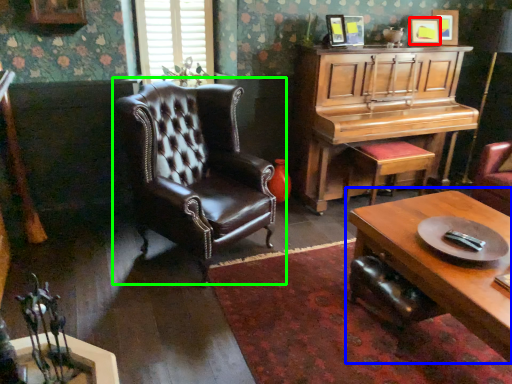
Question: Based on their relative distances, which object is nearer to picture frame (highlighted by a red box)? Choose from coffee table (highlighted by a blue box) and chair (highlighted by a green box).

Choices:
 (A) coffee table
 (B) chair

Answer: (A)